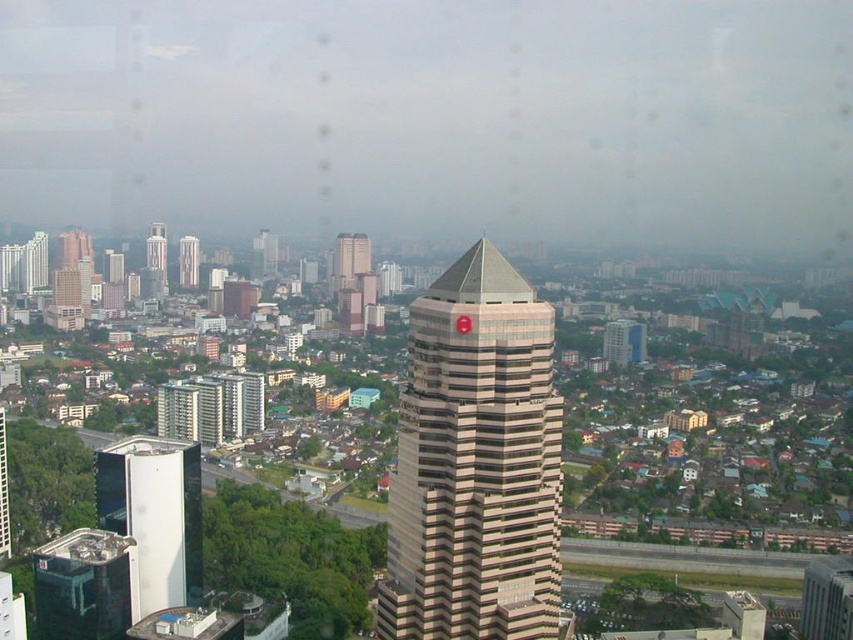
Question: Can you confirm if white glass tower at lower left is positioned below beige concrete building at left?

Choices:
 (A) yes
 (B) no

Answer: (A)

Question: Does beige striped tower at center appear on the right side of beige concrete building at left?

Choices:
 (A) no
 (B) yes

Answer: (B)

Question: Which object is positioned closest to the white glass tower at lower left?

Choices:
 (A) light beige concrete building at center
 (B) beige concrete building at left
 (C) beige striped tower at center
 (D) beige concrete building at center-left

Answer: (C)

Question: Which point is farther from the camera taking this photo?

Choices:
 (A) (358, 244)
 (B) (189, 241)

Answer: (B)

Question: Does white glass tower at lower left have a larger size compared to beige concrete building at left?

Choices:
 (A) yes
 (B) no

Answer: (B)

Question: Based on their relative distances, which object is farther from the light beige concrete building at center?

Choices:
 (A) white glass tower at lower left
 (B) beige striped tower at center

Answer: (A)